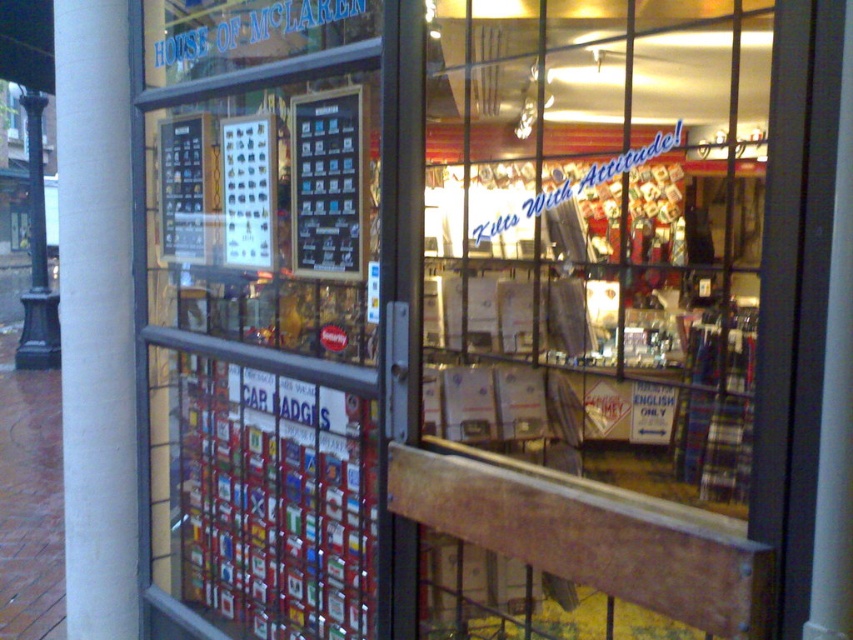
You are standing outside the House of McLaren shop and want to see the transparent glass door at center. Where should you look?

You should look at point (598, 237) to find the transparent glass door at center.

You are standing outside the House of McLaren shop and want to enter. There is a point marked at coordinates (598, 237). Is this point located on the transparent glass door at center?

The transparent glass door at center is represented by point (598, 237), so yes, the point is located on the transparent glass door at center.